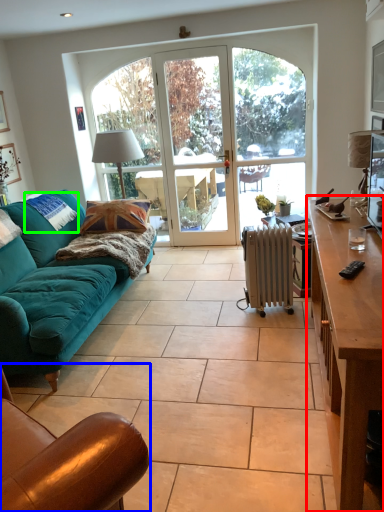
Question: Considering the real-world distances, which object is closest to desk (highlighted by a red box)? chair (highlighted by a blue box) or pillow (highlighted by a green box).

Choices:
 (A) chair
 (B) pillow

Answer: (A)